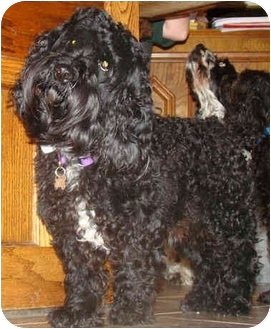
Locate an element on the screen. walls is located at coordinates (13, 168), (179, 80), (263, 45).